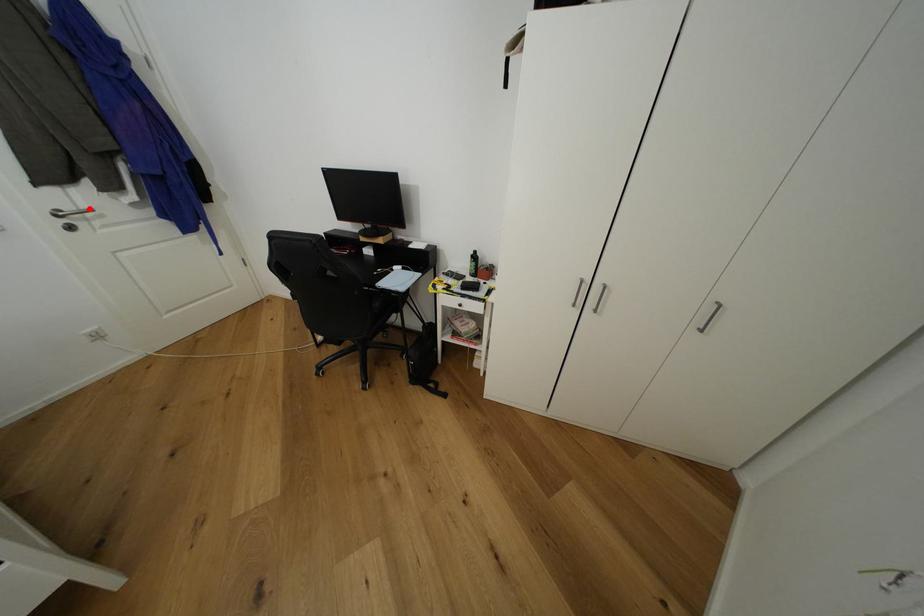
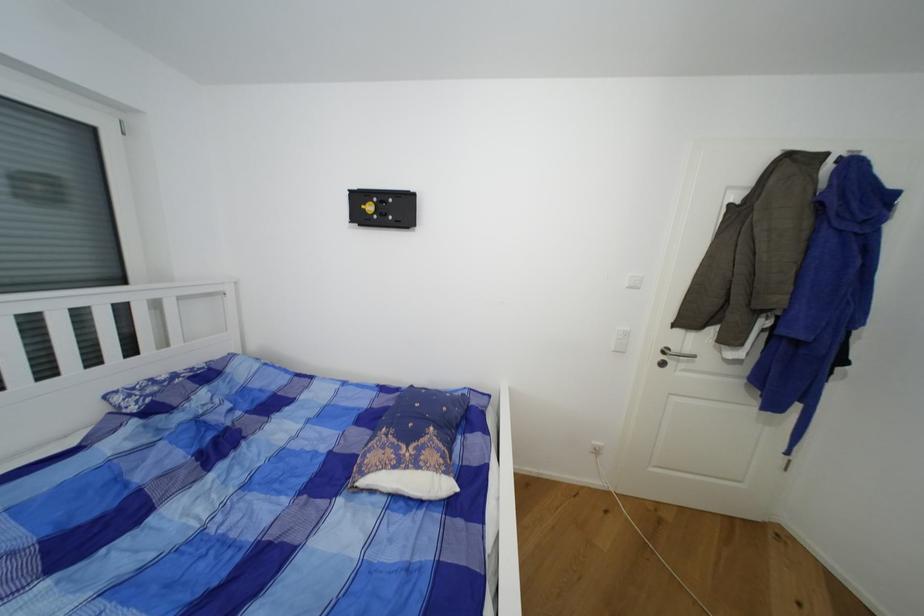
In the second image, find the point that corresponds to the highlighted location in the first image.

(691, 352)